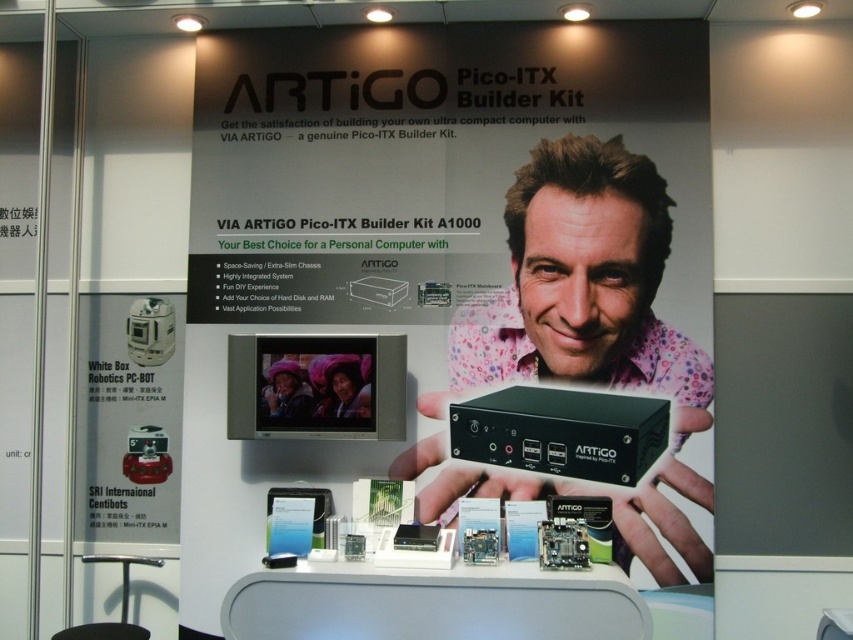
You are setting up a promotional display for the ARTiGO Pico ITX Builder Kit. You need to position the matte black computer at center and the white matte robot at left according to the layout. Which object should be placed on the left side of the display?

The white matte robot at left should be placed on the left side of the display because the matte black computer at center is to the right of it.